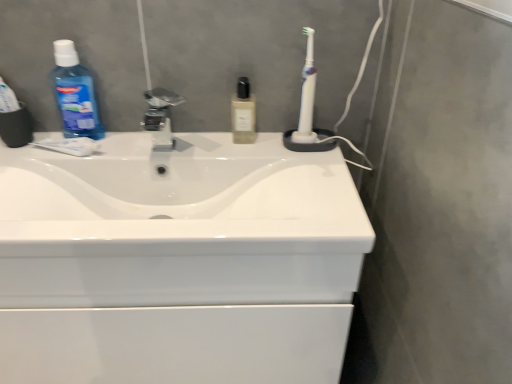
Question: Considering the positions of white glossy sink at center and blue translucent mouthwash at left in the image, is white glossy sink at center taller or shorter than blue translucent mouthwash at left?

Choices:
 (A) tall
 (B) short

Answer: (B)

Question: From a real-world perspective, relative to blue translucent mouthwash at left, is white glossy sink at center vertically above or below?

Choices:
 (A) above
 (B) below

Answer: (B)

Question: Based on their relative distances, which object is farther from the blue translucent mouthwash at left?

Choices:
 (A) white plastic toothbrush at upper right
 (B) white glossy sink at center
 (C) translucent glass bottle at center
 (D) satin nickel faucet at center

Answer: (A)

Question: Considering the real-world distances, which object is closest to the satin nickel faucet at center?

Choices:
 (A) translucent glass bottle at center
 (B) white plastic toothbrush at upper right
 (C) blue translucent mouthwash at left
 (D) white glossy sink at center

Answer: (C)